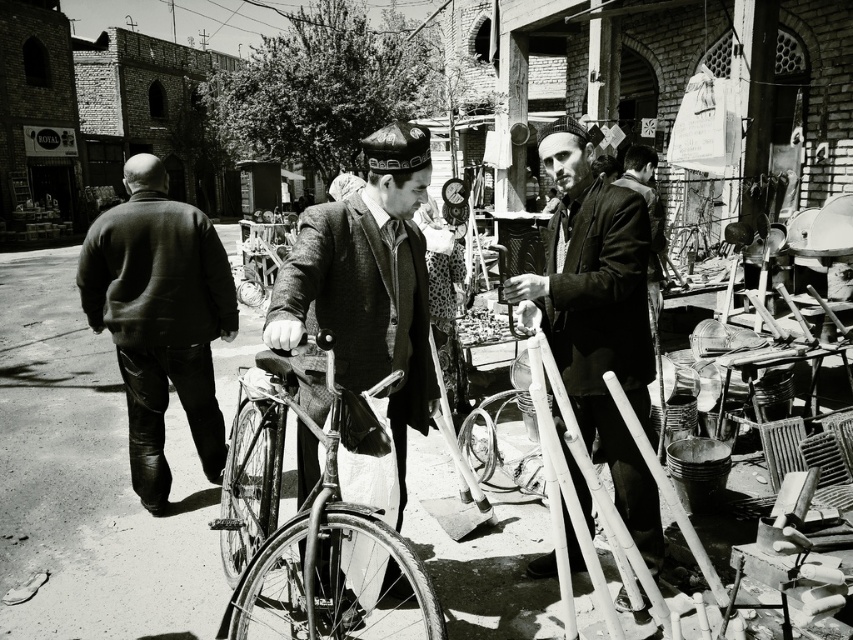
Where is `textured woolen coat at center`? textured woolen coat at center is located at coordinates (368, 284).

Is point (352, 228) positioned in front of point (714, 237)?

Yes.

You are a GUI agent. You are given a task and a screenshot of the screen. Output one action in this format:
    pyautogui.click(x=<x>, y=<y>)
    Task: Click on the textured woolen coat at center
    Image resolution: width=853 pixels, height=640 pixels.
    Given the screenshot: What is the action you would take?
    pos(368,284)

In the scene shown: Between shiny metallic bicycle at center and smooth leather jacket at center, which one appears on the left side from the viewer's perspective?

Positioned to the left is shiny metallic bicycle at center.

Measure the distance between point (262, 456) and camera.

Point (262, 456) is 3.85 meters from camera.

Who is more distant from viewer, (x=346, y=532) or (x=561, y=346)?

Point (x=561, y=346)

Find the location of a particular element. The image size is (853, 640). shiny metallic bicycle at center is located at coordinates (308, 513).

Which is below, shiny metallic bicycle at center or metallic bicycle at center?

shiny metallic bicycle at center is below.

Identify the location of shiny metallic bicycle at center. (308, 513).

Where is `shiny metallic bicycle at center`? This screenshot has height=640, width=853. shiny metallic bicycle at center is located at coordinates (308, 513).